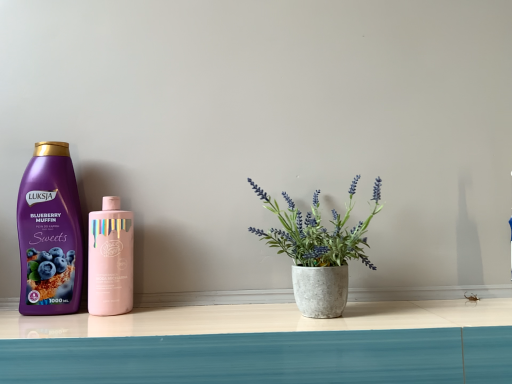
Question: From the image's perspective, is pink glossy bottle at center, arranged as the 2th bottle when viewed from the left, above or below purple matte bottle at left, positioned as the 1th bottle in left-to-right order?

Choices:
 (A) above
 (B) below

Answer: (B)

Question: Which is correct: pink glossy bottle at center, arranged as the 2th bottle when viewed from the left, is inside purple matte bottle at left, positioned as the 1th bottle in left-to-right order, or outside of it?

Choices:
 (A) outside
 (B) inside

Answer: (A)

Question: From a real-world perspective, is pink glossy bottle at center, the first bottle from the right, above or below purple matte bottle at left, positioned as the 1th bottle in left-to-right order?

Choices:
 (A) above
 (B) below

Answer: (B)

Question: In the image, is purple matte bottle at left, the second bottle viewed from the right, positioned in front of or behind pink glossy bottle at center, the first bottle from the right?

Choices:
 (A) front
 (B) behind

Answer: (B)

Question: Considering the positions of purple matte bottle at left, the second bottle viewed from the right, and pink glossy bottle at center, arranged as the 2th bottle when viewed from the left, in the image, is purple matte bottle at left, the second bottle viewed from the right, wider or thinner than pink glossy bottle at center, arranged as the 2th bottle when viewed from the left,?

Choices:
 (A) thin
 (B) wide

Answer: (A)

Question: Is point (45, 292) positioned closer to the camera than point (120, 261)?

Choices:
 (A) farther
 (B) closer

Answer: (A)

Question: Is purple matte bottle at left, positioned as the 1th bottle in left-to-right order, taller or shorter than pink glossy bottle at center, arranged as the 2th bottle when viewed from the left?

Choices:
 (A) short
 (B) tall

Answer: (B)